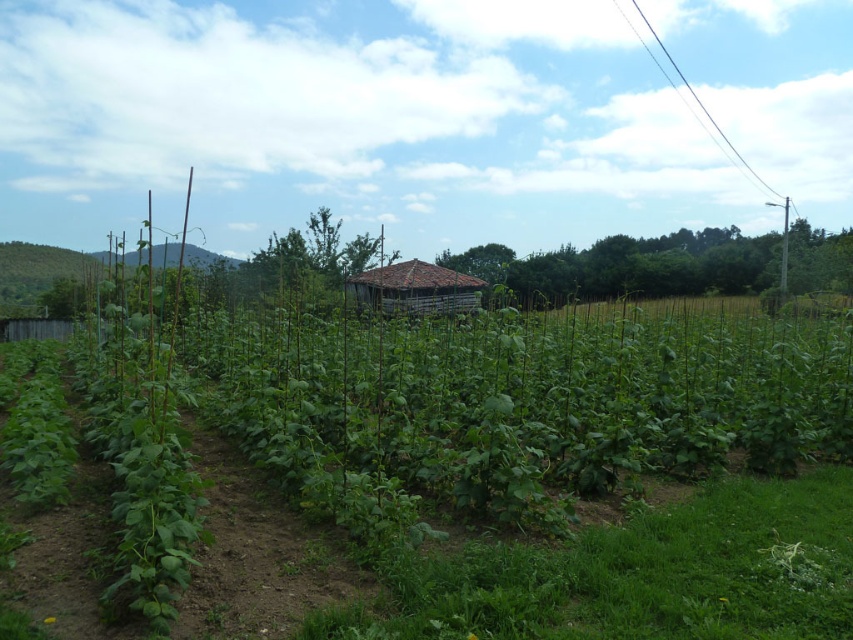
Question: Can you confirm if green leafy plants at center is positioned to the right of brown wooden hut at center?

Choices:
 (A) no
 (B) yes

Answer: (B)

Question: Which object is closer to the camera taking this photo?

Choices:
 (A) brown wooden hut at center
 (B) green leafy plants at center

Answer: (B)

Question: Is green leafy plants at center further to camera compared to brown wooden hut at center?

Choices:
 (A) no
 (B) yes

Answer: (A)

Question: Does green leafy plants at center have a greater width compared to brown wooden hut at center?

Choices:
 (A) yes
 (B) no

Answer: (A)